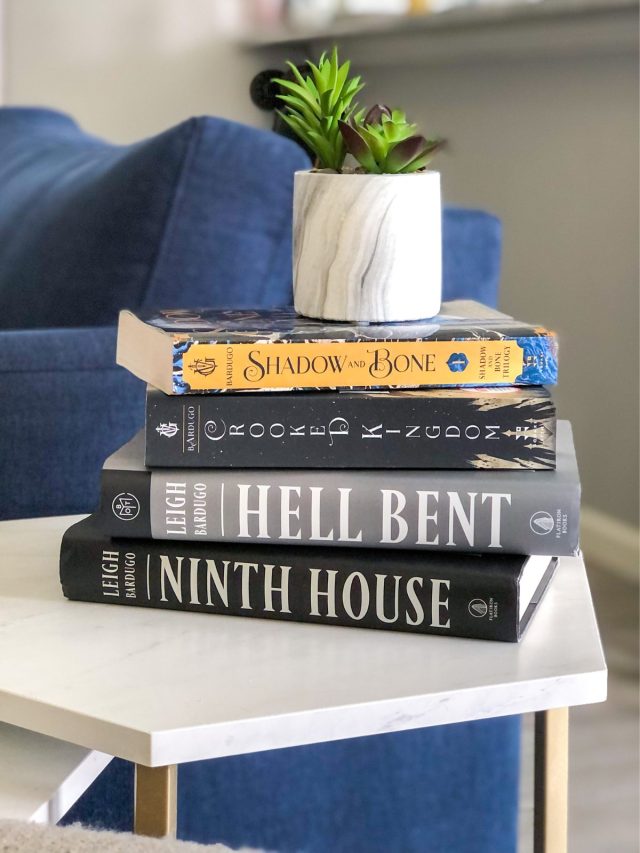
In order to click on plant in this screenshot , I will do `click(324, 96)`.